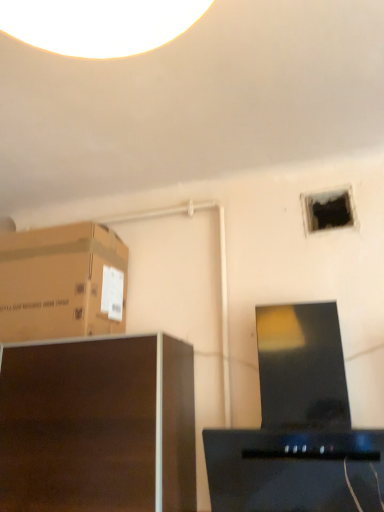
Question: Would you say black glossy desktop computer at center is inside or outside black matte hole at upper right?

Choices:
 (A) inside
 (B) outside

Answer: (B)

Question: Is point (304, 332) closer or farther from the camera than point (342, 195)?

Choices:
 (A) farther
 (B) closer

Answer: (B)

Question: Estimate the real-world distances between objects in this image. Which object is farther from the black matte hole at upper right?

Choices:
 (A) black glossy desktop computer at center
 (B) brown cardboard box at upper left
 (C) dark wood cabinet at lower left

Answer: (C)

Question: Estimate the real-world distances between objects in this image. Which object is closer to the black glossy desktop computer at center?

Choices:
 (A) dark wood cabinet at lower left
 (B) black matte hole at upper right
 (C) brown cardboard box at upper left

Answer: (A)